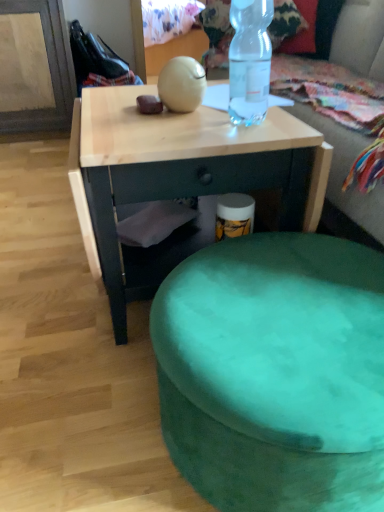
Question: From a real-world perspective, is natural wood desk at center physically below transparent plastic bottle at upper center?

Choices:
 (A) yes
 (B) no

Answer: (A)

Question: Considering the relative sizes of natural wood desk at center and transparent plastic bottle at upper center in the image provided, is natural wood desk at center taller than transparent plastic bottle at upper center?

Choices:
 (A) yes
 (B) no

Answer: (A)

Question: Does natural wood desk at center contain transparent plastic bottle at upper center?

Choices:
 (A) no
 (B) yes

Answer: (A)

Question: Is natural wood desk at center closer to the viewer compared to transparent plastic bottle at upper center?

Choices:
 (A) no
 (B) yes

Answer: (A)

Question: Considering the relative sizes of natural wood desk at center and transparent plastic bottle at upper center in the image provided, is natural wood desk at center smaller than transparent plastic bottle at upper center?

Choices:
 (A) yes
 (B) no

Answer: (B)

Question: Is natural wood desk at center inside or outside of green fabric bean bag at upper center?

Choices:
 (A) inside
 (B) outside

Answer: (B)

Question: In the image, is natural wood desk at center on the left side or the right side of green fabric bean bag at upper center?

Choices:
 (A) right
 (B) left

Answer: (B)

Question: From the image's perspective, is natural wood desk at center positioned above or below green fabric bean bag at upper center?

Choices:
 (A) below
 (B) above

Answer: (A)

Question: From a real-world perspective, is natural wood desk at center physically located above or below green fabric bean bag at upper center?

Choices:
 (A) above
 (B) below

Answer: (B)

Question: In terms of height, does transparent plastic bottle at upper center look taller or shorter compared to natural wood desk at center?

Choices:
 (A) tall
 (B) short

Answer: (B)

Question: Would you say transparent plastic bottle at upper center is to the left or to the right of natural wood desk at center in the picture?

Choices:
 (A) left
 (B) right

Answer: (B)

Question: Is transparent plastic bottle at upper center inside or outside of natural wood desk at center?

Choices:
 (A) inside
 (B) outside

Answer: (B)

Question: In terms of width, does transparent plastic bottle at upper center look wider or thinner when compared to natural wood desk at center?

Choices:
 (A) wide
 (B) thin

Answer: (B)

Question: From the image's perspective, is transparent plastic bottle at upper center positioned above or below velvet green ottoman at lower center?

Choices:
 (A) below
 (B) above

Answer: (B)

Question: From a real-world perspective, is transparent plastic bottle at upper center positioned above or below velvet green ottoman at lower center?

Choices:
 (A) above
 (B) below

Answer: (A)